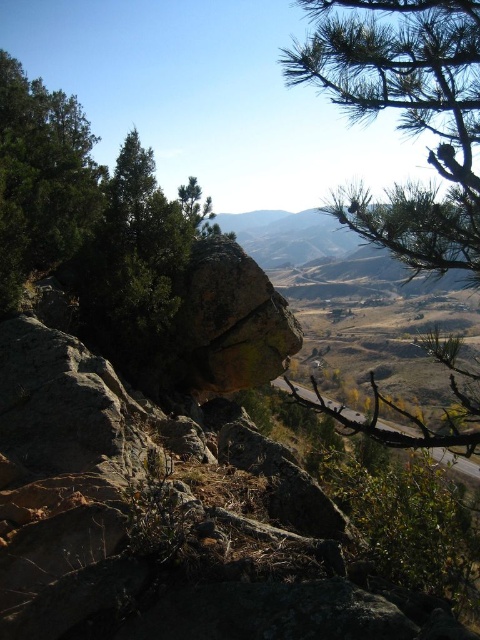
Question: Which object is farther from the camera taking this photo?

Choices:
 (A) green needle-like at upper right
 (B) green matte tree at upper left

Answer: (B)

Question: Which point is closer to the camera?

Choices:
 (A) (183, 224)
 (B) (316, 64)

Answer: (B)

Question: Is green needle-like at upper right to the right of green matte tree at upper left from the viewer's perspective?

Choices:
 (A) no
 (B) yes

Answer: (B)

Question: Does green needle-like at upper right have a larger size compared to green matte tree at upper left?

Choices:
 (A) no
 (B) yes

Answer: (B)

Question: Does green needle-like at upper right appear over green matte tree at upper left?

Choices:
 (A) no
 (B) yes

Answer: (B)